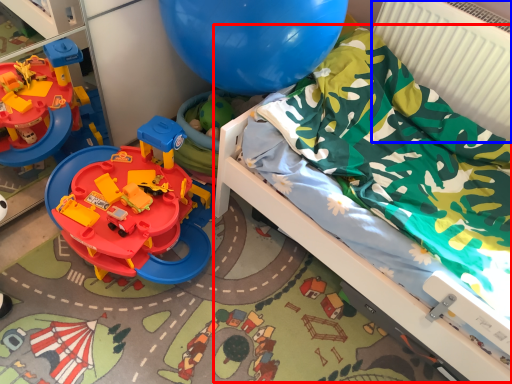
Question: Which of the following is the farthest to the observer, bed (highlighted by a red box) or radiator (highlighted by a blue box)?

Choices:
 (A) bed
 (B) radiator

Answer: (B)